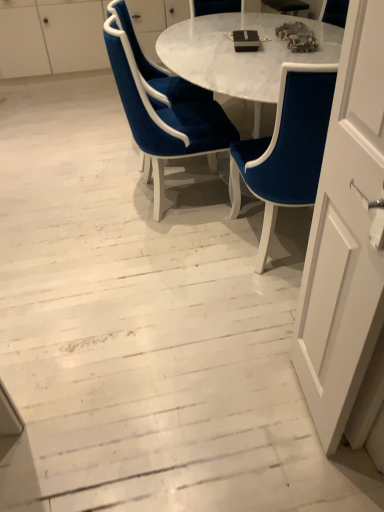
Where is `free space that is to the left of velvet blue chair at center, which is the 1th chair from right to left`? The width and height of the screenshot is (384, 512). free space that is to the left of velvet blue chair at center, which is the 1th chair from right to left is located at coordinates (181, 259).